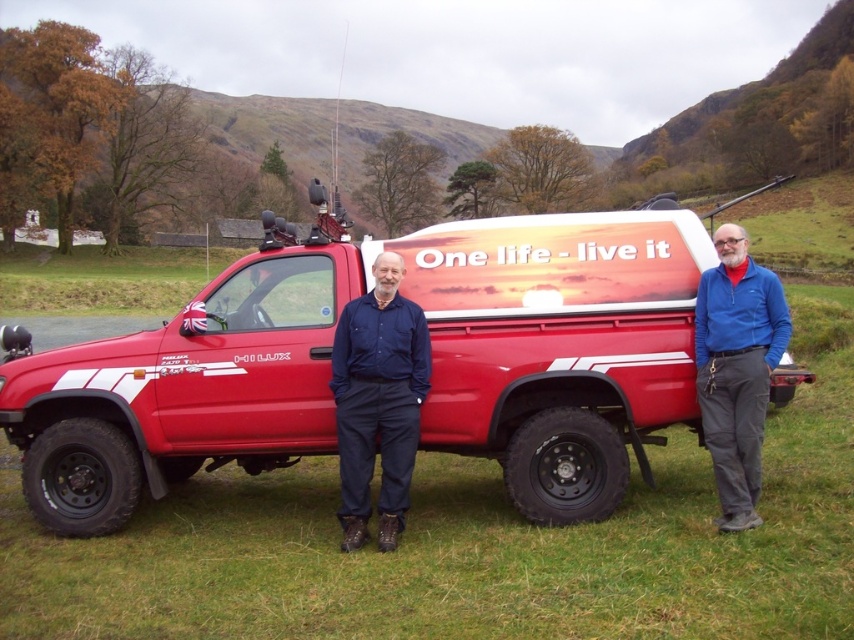
Which is in front, point (206, 326) or point (413, 429)?

Point (413, 429) is in front.

Does point (478, 310) come farther from viewer compared to point (404, 305)?

Yes, point (478, 310) is behind point (404, 305).

This screenshot has height=640, width=854. Find the location of `shiny red truck at center`. shiny red truck at center is located at coordinates (431, 364).

Who is taller, matte blue shirt at center or blue fabric jacket at right?

matte blue shirt at center

The width and height of the screenshot is (854, 640). Describe the element at coordinates (378, 401) in the screenshot. I see `matte blue shirt at center` at that location.

Where is `matte blue shirt at center`? matte blue shirt at center is located at coordinates (378, 401).

Between shiny red truck at center and blue fabric jacket at right, which one has more height?

shiny red truck at center is taller.

Is shiny red truck at center smaller than blue fabric jacket at right?

No, shiny red truck at center is not smaller than blue fabric jacket at right.

Where is `shiny red truck at center`? shiny red truck at center is located at coordinates (431, 364).

The height and width of the screenshot is (640, 854). I want to click on shiny red truck at center, so click(x=431, y=364).